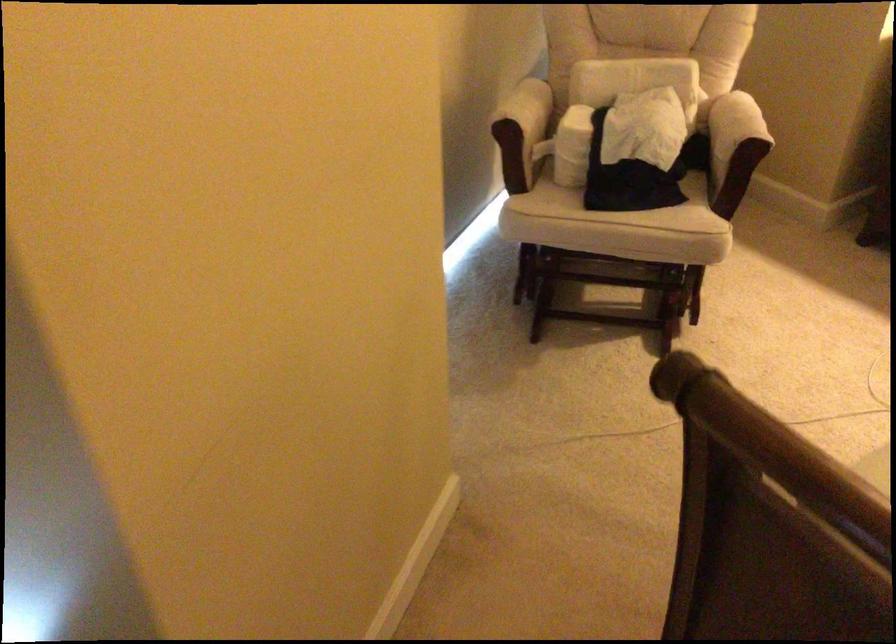
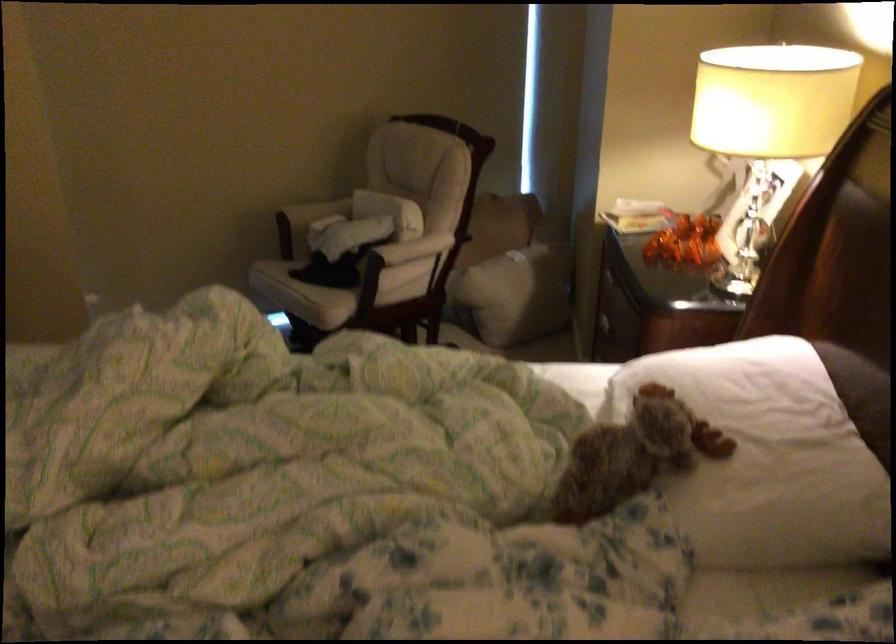
Where in the second image is the point corresponding to point 634,223 from the first image?

(291, 285)